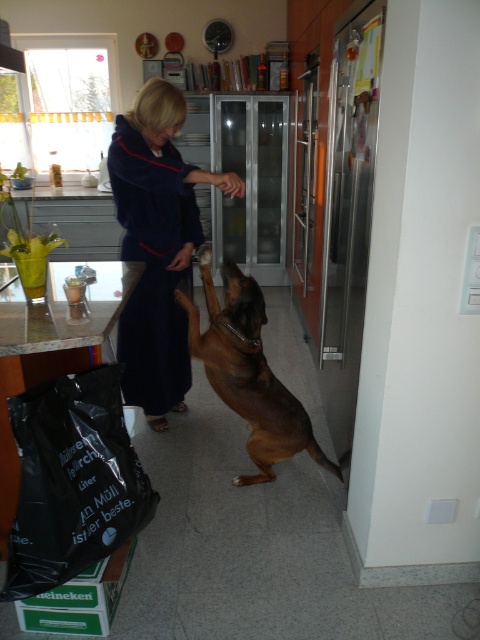
Question: Does velvet-like navy blue robe at center have a greater width compared to stainless steel refrigerator at right?

Choices:
 (A) no
 (B) yes

Answer: (B)

Question: Considering the relative positions of velvet-like navy blue robe at center and stainless steel refrigerator at right in the image provided, where is velvet-like navy blue robe at center located with respect to stainless steel refrigerator at right?

Choices:
 (A) above
 (B) below

Answer: (B)

Question: Can you confirm if stainless steel refrigerator at right is bigger than brown shiny dog at center?

Choices:
 (A) no
 (B) yes

Answer: (A)

Question: Which point is farther to the camera?

Choices:
 (A) stainless steel refrigerator at right
 (B) brown shiny dog at center

Answer: (B)

Question: Based on their relative distances, which object is farther from the stainless steel refrigerator at right?

Choices:
 (A) brown shiny dog at center
 (B) velvet-like navy blue robe at center

Answer: (B)

Question: Which point is farther from the camera taking this photo?

Choices:
 (A) (289, 456)
 (B) (372, 3)
 (C) (180, 259)

Answer: (C)